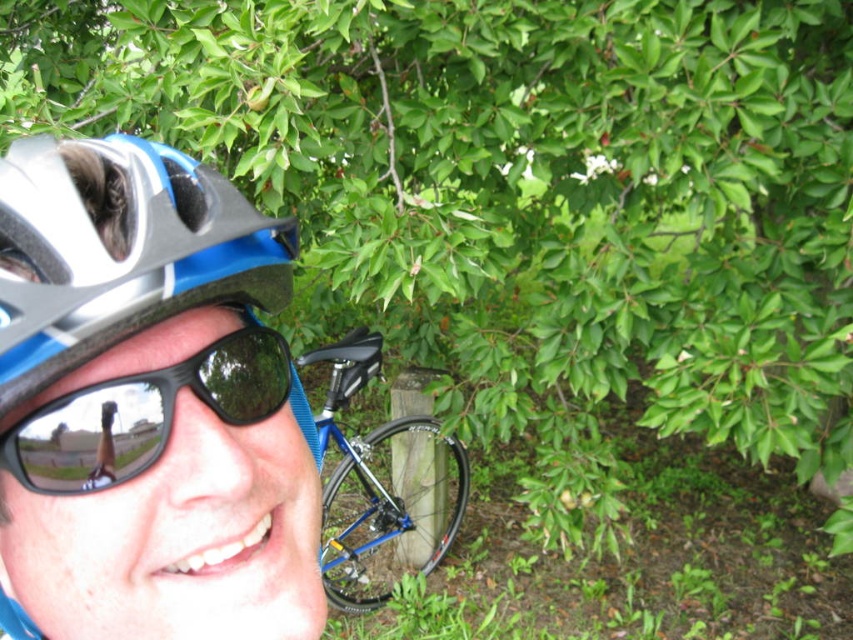
Does matte blue helmet at left have a greater height compared to black reflective sunglasses at lower left?

Correct, matte blue helmet at left is much taller as black reflective sunglasses at lower left.

Does point (39, 298) lie in front of point (155, 371)?

Yes, it is in front of point (155, 371).

At what (x,y) coordinates should I click in order to perform the action: click on matte blue helmet at left. Please return your answer as a coordinate pair (x, y). The width and height of the screenshot is (853, 640). Looking at the image, I should click on (125, 256).

Does blue metallic bicycle at center have a larger size compared to black reflective sunglasses at lower left?

Yes, blue metallic bicycle at center is bigger than black reflective sunglasses at lower left.

This screenshot has width=853, height=640. In order to click on blue metallic bicycle at center in this screenshot , I will do `click(381, 483)`.

Can you confirm if matte blue helmet at left is positioned to the left of blue metallic bicycle at center?

No, matte blue helmet at left is not to the left of blue metallic bicycle at center.

Which is in front, point (36, 266) or point (419, 413)?

Point (36, 266) is more forward.

Identify the location of matte blue helmet at left. click(x=125, y=256).